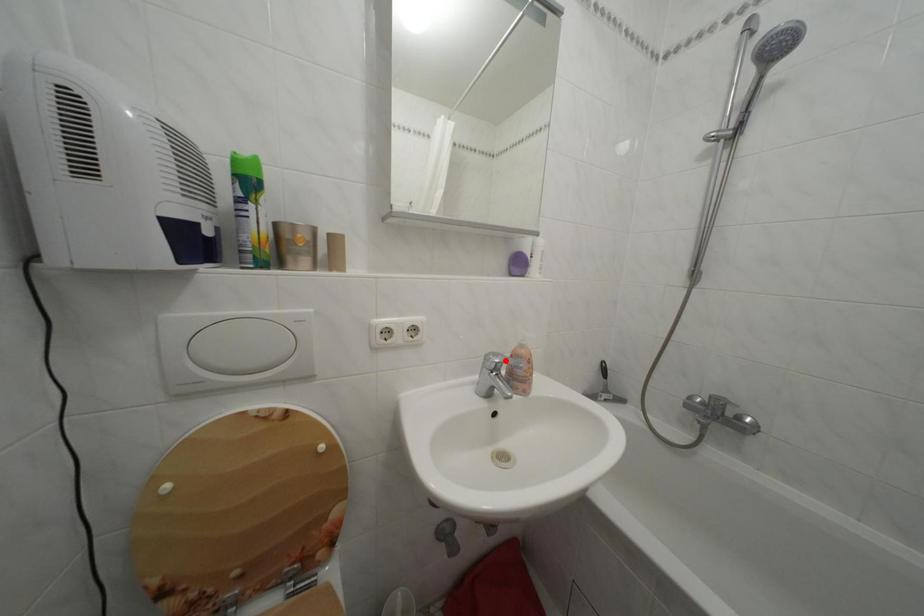
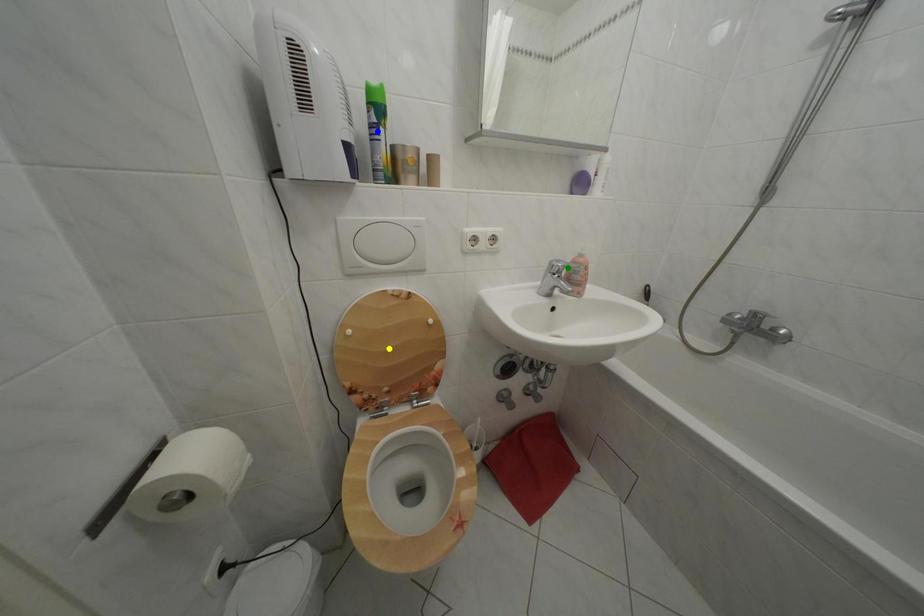
Question: I am providing you with two images of the same scene from different viewpoints. A red point is marked on the first image. You are given multiple points on the second image. Which point in image 2 represents the same 3d spot as the red point in image 1?

Choices:
 (A) green point
 (B) yellow point
 (C) blue point

Answer: (A)